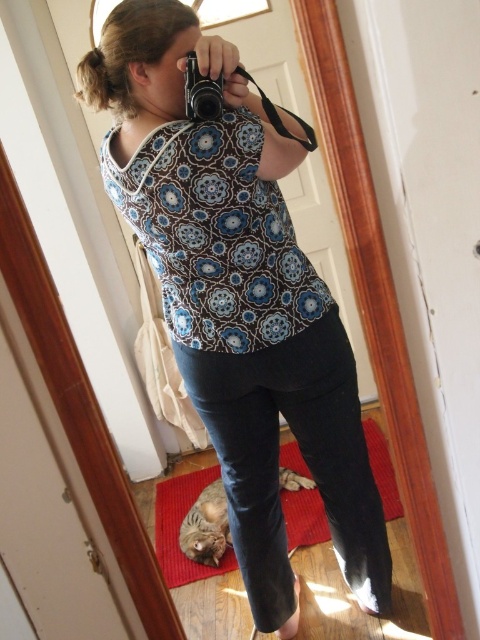
You are trying to take a selfie using a mirror while holding a camera. You notice the patterned fabric blouse at center and the black plastic camera at upper center in your reflection. Which object is positioned to the right side in the mirror?

The patterned fabric blouse at center is to the right of the black plastic camera at upper center in the mirror.

You are trying to take a selfie using a mirror. You have a patterned fabric blouse at center and a black plastic camera at upper center. How far apart are these two items?

The patterned fabric blouse at center and black plastic camera at upper center are 20.67 inches apart.

You are trying to take a selfie using a mirror. You have a patterned fabric blouse at center and a black plastic camera at upper center. According to the scene, which object is positioned behind the other?

The black plastic camera at upper center is behind the patterned fabric blouse at center, so the camera is positioned behind the blouse.